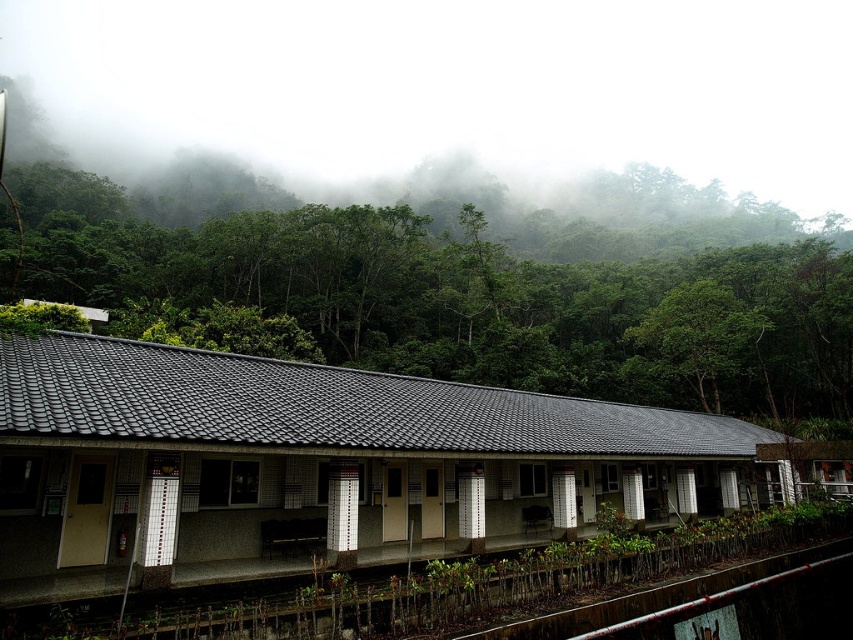
You are a delivery person with a cart that is 10 feet wide. You need to move from the metallic pipe at lower right to the white tile railway station at center. Is there enough space between them for your cart to pass through?

The distance between the white tile railway station at center and the metallic pipe at lower right is 24.08 feet. Since the cart is 10 feet wide, there is sufficient space for it to pass through as 24.08 feet is greater than 10 feet.

You are a traveler standing on the covered porch of the building. You see the white tile railway station at center and the metallic pipe at lower right. Which object is closer to you?

The white tile railway station at center is closer to you since it is positioned in front of the metallic pipe at lower right.

You are standing at the entrance of the long, single story building with a traditional tiled roof. You want to take a photo of the green leafy tree at center from the porch. Where should you position yourself on the porch to ensure the tree is in the center of your photo?

You should position yourself at the center of the porch to ensure the green leafy tree at center is in the center of your photo since it is located at point (457, 298).